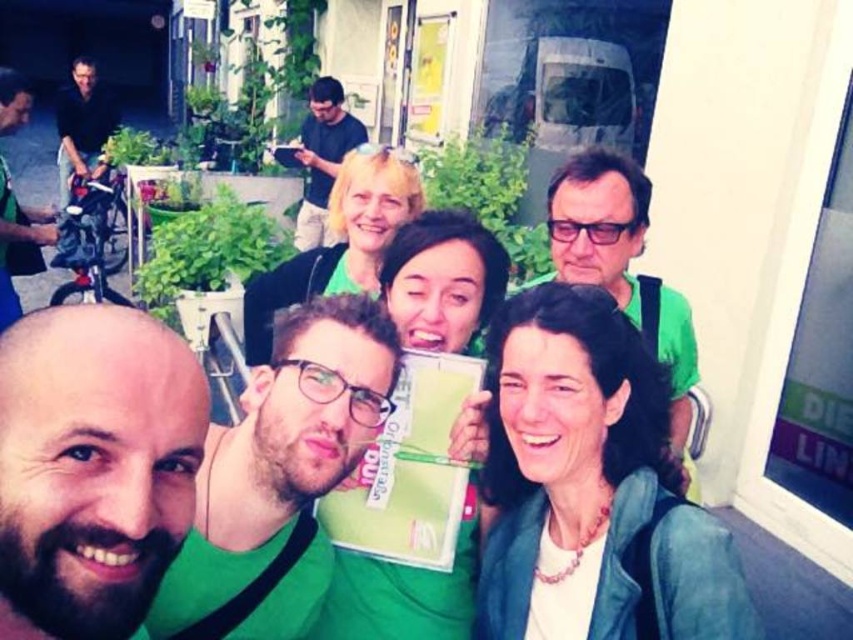
Question: Which of these objects is positioned closest to the green matte shirt at upper center?

Choices:
 (A) bald head at center
 (B) green matte shirt at center
 (C) matte green jacket at lower right

Answer: (C)

Question: Does matte green jacket at lower right appear on the left side of green matte shirt at upper center?

Choices:
 (A) yes
 (B) no

Answer: (A)

Question: Considering the relative positions of green matte shirt at center and black matte shirt at left in the image provided, where is green matte shirt at center located with respect to black matte shirt at left?

Choices:
 (A) below
 (B) above

Answer: (A)

Question: Which object is positioned farthest from the black cotton shirt at upper center?

Choices:
 (A) green matte shirt at upper center
 (B) black matte shirt at left
 (C) matte green jacket at lower right
 (D) bald head at center

Answer: (D)

Question: Which point is farther to the camera?

Choices:
 (A) bald head at center
 (B) matte green jacket at lower right
 (C) black matte shirt at left

Answer: (C)

Question: Is matte green jacket at lower right further to camera compared to bald head at center?

Choices:
 (A) no
 (B) yes

Answer: (B)